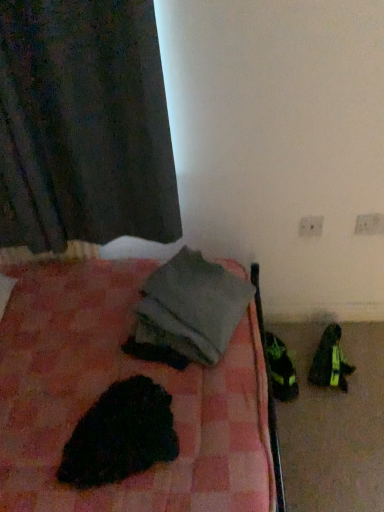
Question: Can you confirm if dark matte fabric curtain at upper left is smaller than black fuzzy animal at lower left?

Choices:
 (A) no
 (B) yes

Answer: (A)

Question: Can you confirm if dark matte fabric curtain at upper left is wider than black fuzzy animal at lower left?

Choices:
 (A) yes
 (B) no

Answer: (B)

Question: Considering the relative sizes of dark matte fabric curtain at upper left and black fuzzy animal at lower left in the image provided, is dark matte fabric curtain at upper left bigger than black fuzzy animal at lower left?

Choices:
 (A) no
 (B) yes

Answer: (B)

Question: From a real-world perspective, is dark matte fabric curtain at upper left on top of black fuzzy animal at lower left?

Choices:
 (A) no
 (B) yes

Answer: (B)

Question: Is dark matte fabric curtain at upper left facing towards black fuzzy animal at lower left?

Choices:
 (A) no
 (B) yes

Answer: (B)

Question: Are dark matte fabric curtain at upper left and black fuzzy animal at lower left located far from each other?

Choices:
 (A) no
 (B) yes

Answer: (A)

Question: Is black fuzzy animal at lower left inside gray fabric at center?

Choices:
 (A) yes
 (B) no

Answer: (B)

Question: Is gray fabric at center positioned behind black fuzzy animal at lower left?

Choices:
 (A) yes
 (B) no

Answer: (A)

Question: Can you confirm if gray fabric at center is taller than black fuzzy animal at lower left?

Choices:
 (A) no
 (B) yes

Answer: (B)

Question: Considering the relative sizes of gray fabric at center and black fuzzy animal at lower left in the image provided, is gray fabric at center bigger than black fuzzy animal at lower left?

Choices:
 (A) yes
 (B) no

Answer: (A)

Question: Is gray fabric at center shorter than black fuzzy animal at lower left?

Choices:
 (A) no
 (B) yes

Answer: (A)

Question: Is gray fabric at center looking in the opposite direction of black fuzzy animal at lower left?

Choices:
 (A) no
 (B) yes

Answer: (A)

Question: Considering the relative sizes of gray fabric at center and white plastic electric outlet at upper right, which is counted as the 1th electric outlet, starting from the right, in the image provided, is gray fabric at center shorter than white plastic electric outlet at upper right, which is counted as the 1th electric outlet, starting from the right,?

Choices:
 (A) yes
 (B) no

Answer: (B)